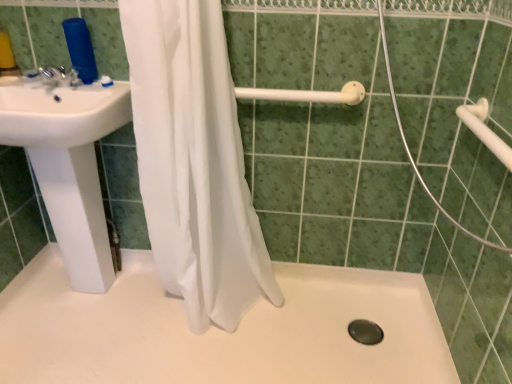
Question: From the image's perspective, is white matte shower door at center located beneath white plastic shower rod at upper center?

Choices:
 (A) no
 (B) yes

Answer: (B)

Question: Is white matte shower door at center positioned behind white plastic shower rod at upper center?

Choices:
 (A) yes
 (B) no

Answer: (B)

Question: Is white matte shower door at center wider than white plastic shower rod at upper center?

Choices:
 (A) yes
 (B) no

Answer: (A)

Question: Is white matte shower door at center to the left of white plastic shower rod at upper center from the viewer's perspective?

Choices:
 (A) yes
 (B) no

Answer: (B)

Question: Would you say white matte shower door at center contains white plastic shower rod at upper center?

Choices:
 (A) yes
 (B) no

Answer: (B)

Question: Which is correct: black rubber drain at bottom center is inside white sheer curtain at center, or outside of it?

Choices:
 (A) outside
 (B) inside

Answer: (A)

Question: Considering their positions, is black rubber drain at bottom center located in front of or behind white sheer curtain at center?

Choices:
 (A) behind
 (B) front

Answer: (A)

Question: From the image's perspective, is black rubber drain at bottom center located above or below white sheer curtain at center?

Choices:
 (A) above
 (B) below

Answer: (B)

Question: From a real-world perspective, relative to white sheer curtain at center, is black rubber drain at bottom center vertically above or below?

Choices:
 (A) above
 (B) below

Answer: (B)

Question: In the image, is black rubber drain at bottom center on the left side or the right side of white matte shower door at center?

Choices:
 (A) left
 (B) right

Answer: (A)

Question: Considering the positions of point (377, 339) and point (384, 41), is point (377, 339) closer or farther from the camera than point (384, 41)?

Choices:
 (A) closer
 (B) farther

Answer: (B)

Question: Is black rubber drain at bottom center taller or shorter than white matte shower door at center?

Choices:
 (A) short
 (B) tall

Answer: (A)

Question: From a real-world perspective, relative to white matte shower door at center, is black rubber drain at bottom center vertically above or below?

Choices:
 (A) above
 (B) below

Answer: (B)

Question: From their relative heights in the image, would you say white glossy sink at left is taller or shorter than white sheer curtain at center?

Choices:
 (A) short
 (B) tall

Answer: (A)

Question: Does point (9, 87) appear closer or farther from the camera than point (160, 153)?

Choices:
 (A) farther
 (B) closer

Answer: (A)